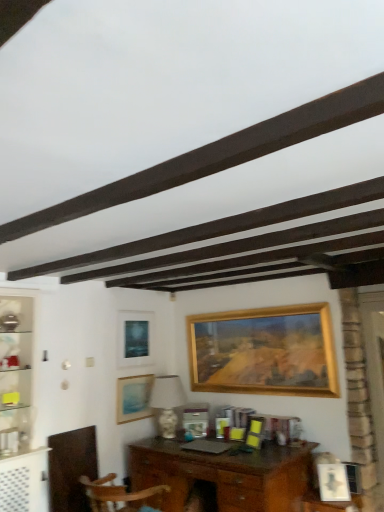
This screenshot has height=512, width=384. What are the coordinates of `empty space that is ontop of gold wooden picture frame at center, arranged as the 4th picture frame when viewed from the left (from a real-world perspective)` in the screenshot? It's located at (238, 312).